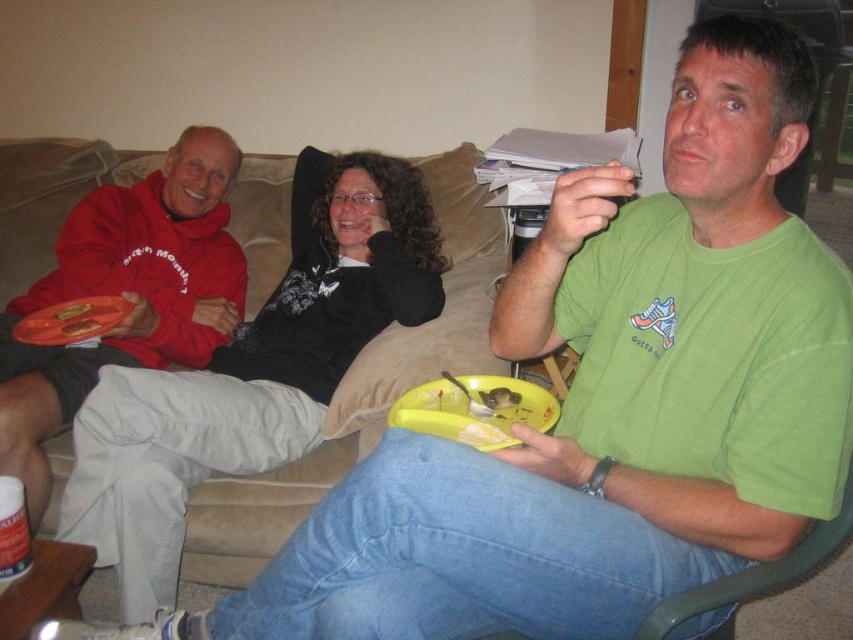
You are standing in the living room and want to reach a point located at coordinates point (x=312, y=388). If you can move forward 5 feet, will you be able to reach that point?

The distance of point (x=312, y=388) from camera is 5.61 feet. Since you can move forward 5 feet, you will not be able to reach the point as the distance required is greater than your movement capability.

You are a chef preparing a meal and need to determine if the yellow plastic fork at lower center can fit into the matte plastic snack at center. Based on their sizes, can the fork fit inside the snack?

The yellow plastic fork at lower center is narrower than the matte plastic snack at center, so the fork can fit inside the snack.

Looking at this image, you are a guest at a dinner party and see the yellow plastic fork at lower center and the matte plastic snack at center. Which item is smaller?

The yellow plastic fork at lower center is smaller than the matte plastic snack at center.